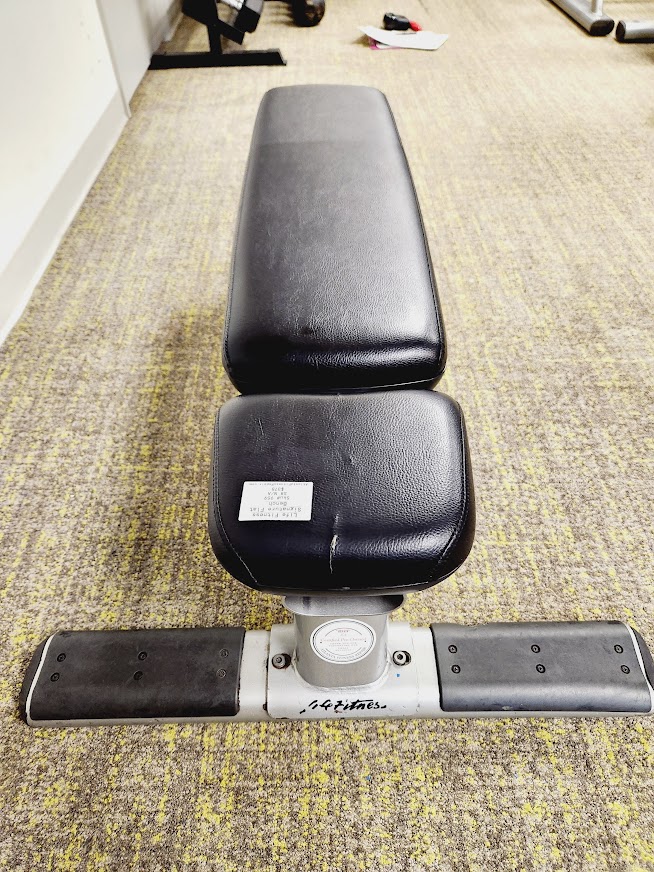
Where is `floor`? floor is located at coordinates (93, 412).